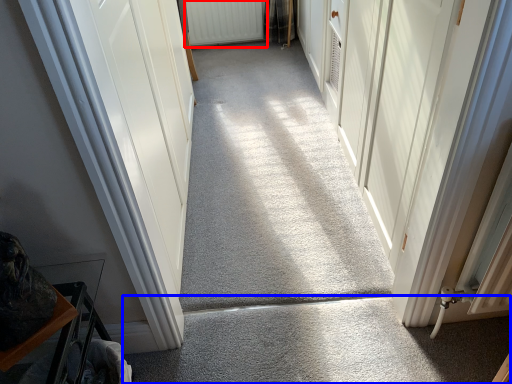
Question: Which object is closer to the camera taking this photo, radiator (highlighted by a red box) or concrete (highlighted by a blue box)?

Choices:
 (A) radiator
 (B) concrete

Answer: (B)